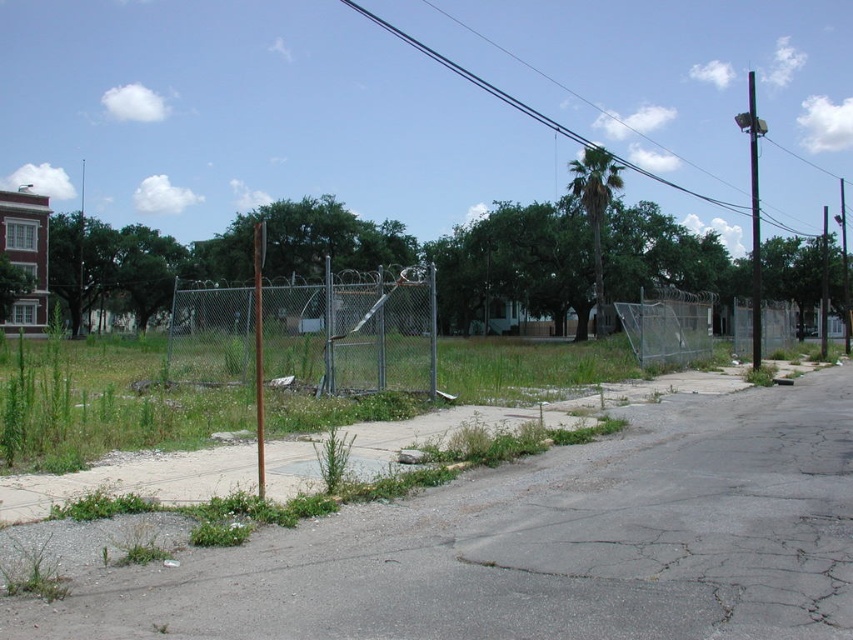
Does green chain-link fence at center come in front of green grass at lower left?

No, green chain-link fence at center is behind green grass at lower left.

Who is positioned more to the left, green chain-link fence at center or green grass at lower left?

From the viewer's perspective, green chain-link fence at center appears more on the left side.

Describe the element at coordinates (310, 332) in the screenshot. I see `green chain-link fence at center` at that location.

The height and width of the screenshot is (640, 853). Find the location of `green chain-link fence at center`. green chain-link fence at center is located at coordinates (310, 332).

In the scene shown: Which of these two, green grass at lower left or green leafy weed at lower center, stands shorter?

green grass at lower left is shorter.

Which is above, green grass at lower left or green leafy weed at lower center?

green leafy weed at lower center is above.

Is point (10, 564) farther from viewer compared to point (341, 444)?

No, (10, 564) is closer to viewer.

The height and width of the screenshot is (640, 853). Find the location of `green grass at lower left`. green grass at lower left is located at coordinates (32, 572).

Is green chain-link fence at center above green leafy weed at lower center?

Correct, green chain-link fence at center is located above green leafy weed at lower center.

Is point (260, 300) behind point (335, 456)?

Yes, it is.

The image size is (853, 640). What do you see at coordinates (310, 332) in the screenshot? I see `green chain-link fence at center` at bounding box center [310, 332].

Find the location of a particular element. The image size is (853, 640). green chain-link fence at center is located at coordinates (310, 332).